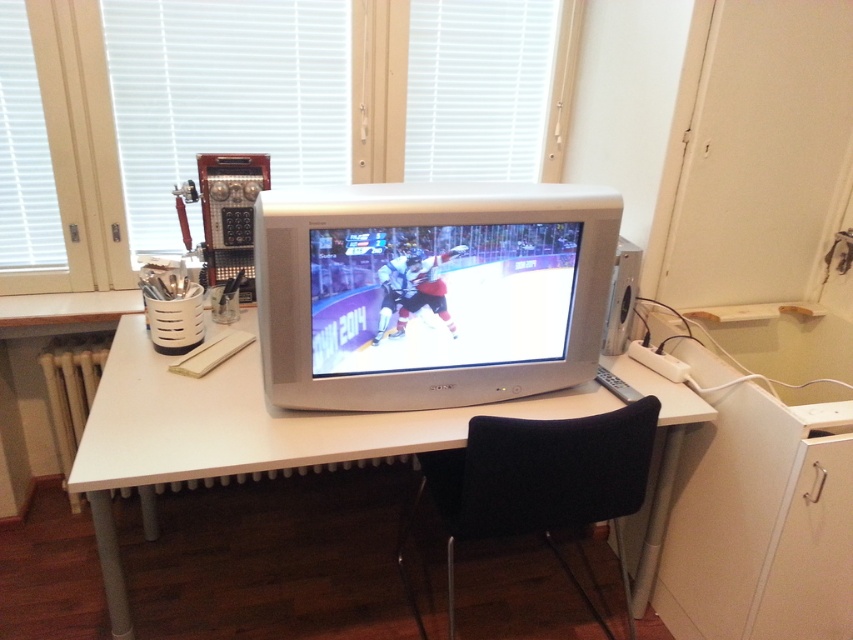
Question: Is matte gray monitor at center below white glossy computer desk at center?

Choices:
 (A) no
 (B) yes

Answer: (A)

Question: Does white glossy computer desk at center appear over black fabric chair at center?

Choices:
 (A) yes
 (B) no

Answer: (A)

Question: Does matte gray monitor at center have a lesser width compared to black fabric chair at center?

Choices:
 (A) yes
 (B) no

Answer: (B)

Question: Estimate the real-world distances between objects in this image. Which object is farther from the matte gray monitor at center?

Choices:
 (A) black fabric chair at center
 (B) white glossy computer desk at center

Answer: (A)

Question: Which object is closer to the camera taking this photo?

Choices:
 (A) matte gray monitor at center
 (B) white glossy computer desk at center

Answer: (B)

Question: Which point appears farthest from the camera in this image?

Choices:
 (A) (606, 472)
 (B) (497, 202)
 (C) (155, 452)

Answer: (A)